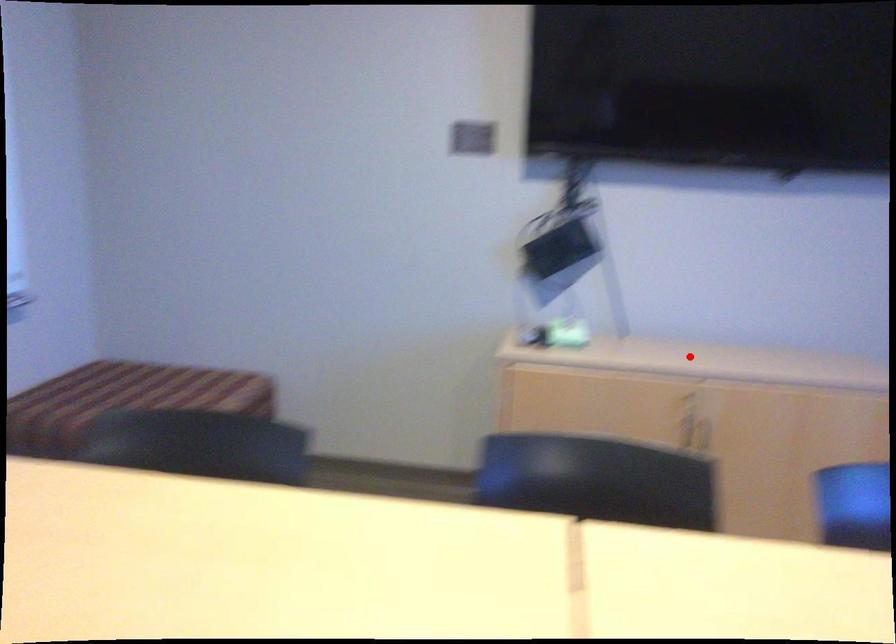
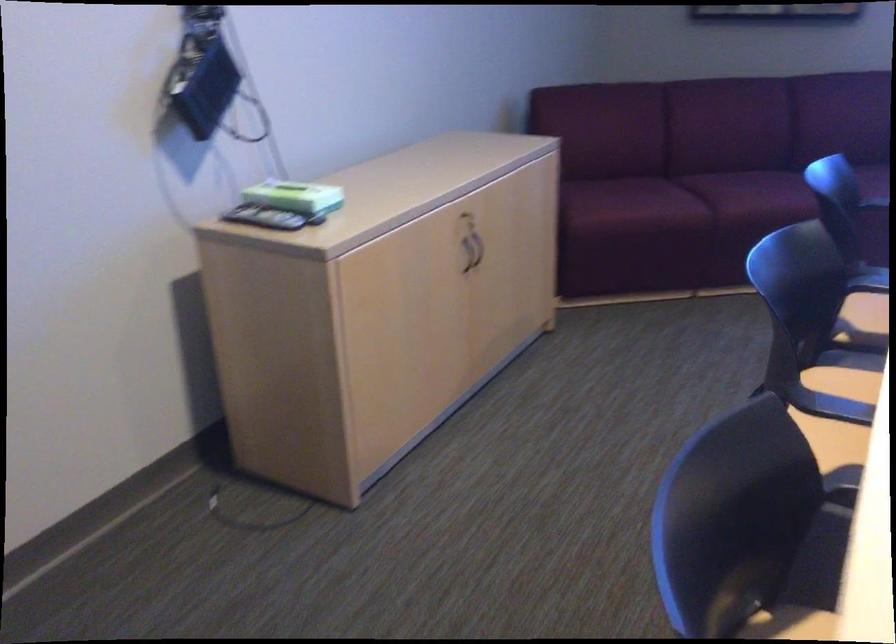
Question: I am providing you with two images of the same scene from different viewpoints. Given a red point in image1, look at the same physical point in image2. Is it:

Choices:
 (A) Closer to the viewpoint
 (B) Farther from the viewpoint

Answer: (A)